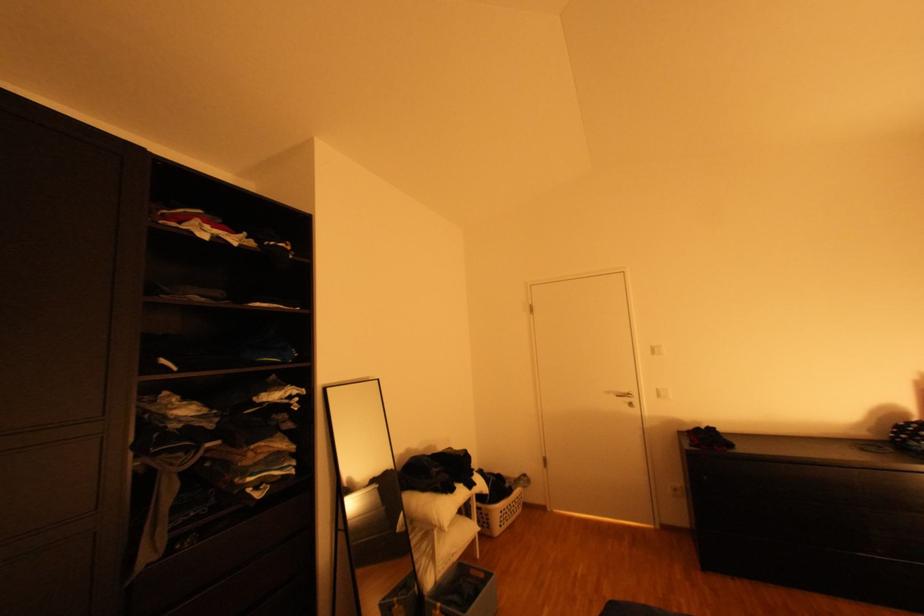
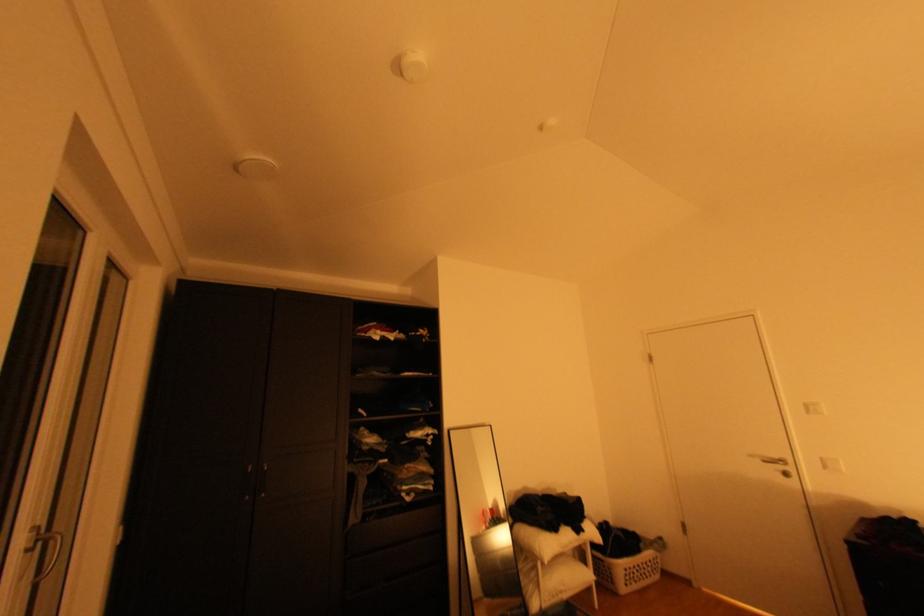
Find the pixel in the second image that matches the point at 516,513 in the first image.

(642, 573)